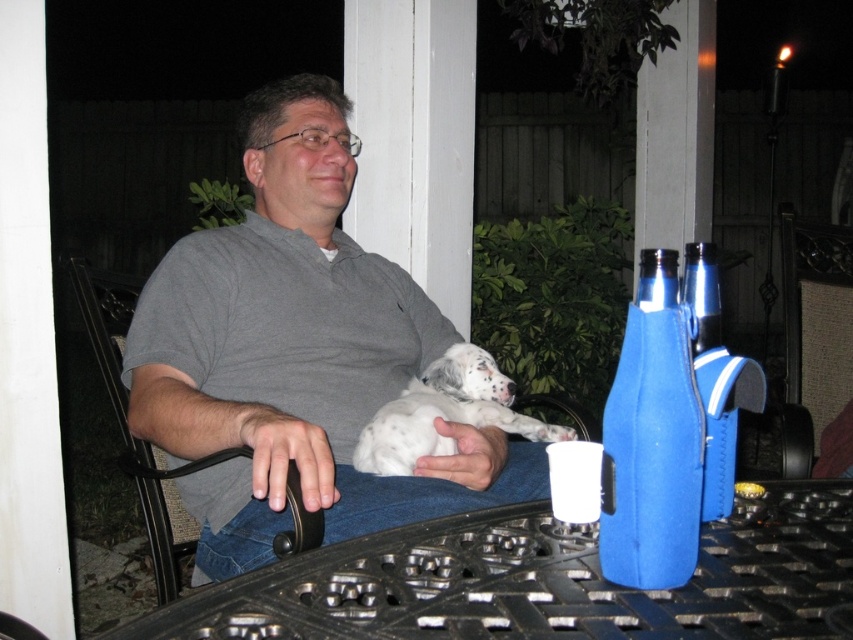
Question: Which point is closer to the camera taking this photo?

Choices:
 (A) (323, 132)
 (B) (833, 456)

Answer: (A)

Question: Where is metallic black table at lower center located in relation to blue neoprene bottle at lower right in the image?

Choices:
 (A) right
 (B) left

Answer: (B)

Question: Which object appears farthest from the camera in this image?

Choices:
 (A) white soft fur dog at center
 (B) black plastic chair at lower right
 (C) metallic black table at lower center

Answer: (B)

Question: Is metallic black table at lower center below shiny metallic bottle at right?

Choices:
 (A) yes
 (B) no

Answer: (A)

Question: Considering the real-world distances, which object is farthest from the metallic black table at lower center?

Choices:
 (A) black plastic chair at lower right
 (B) gray cotton shirt at center

Answer: (A)

Question: Is gray cotton shirt at center above white soft fur dog at center?

Choices:
 (A) no
 (B) yes

Answer: (B)